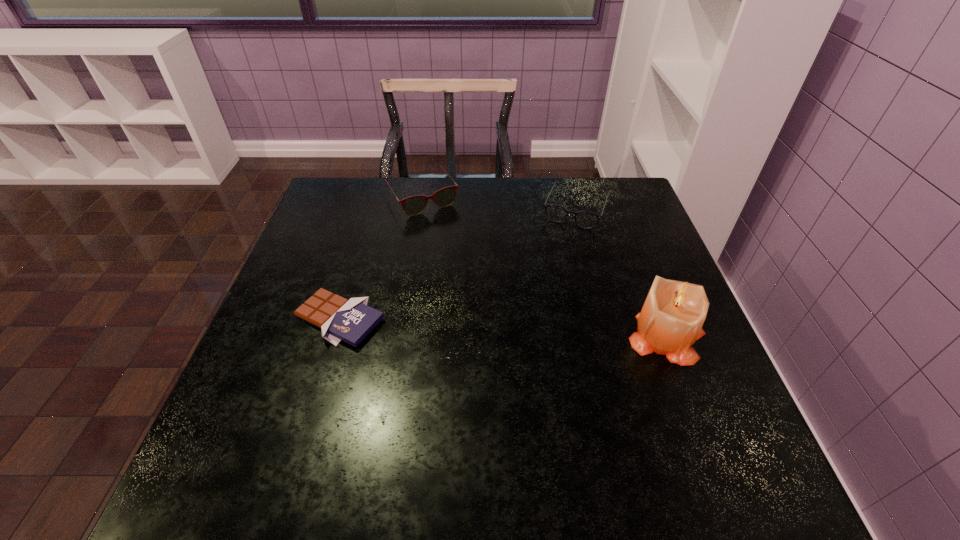
The height and width of the screenshot is (540, 960). In the image, there is a desktop. In order to click on vacant space at the far left corner in this screenshot , I will do `click(371, 190)`.

In the image, there is a desktop. Identify the location of free space at the far right corner. The image size is (960, 540). click(x=622, y=217).

I want to click on vacant space that's between the candle and the left spectacles, so click(544, 268).

Find the location of a particular element. The height and width of the screenshot is (540, 960). free area in between the tallest object and the right spectacles is located at coordinates (622, 273).

You are a GUI agent. You are given a task and a screenshot of the screen. Output one action in this format:
    pyautogui.click(x=<x>, y=<y>)
    Task: Click on the vacant space that's between the tallest object and the shortest object
    This screenshot has width=960, height=540.
    Given the screenshot: What is the action you would take?
    pyautogui.click(x=503, y=328)

At what (x,y) coordinates should I click in order to perform the action: click on free space between the candle and the left spectacles. Please return your answer as a coordinate pair (x, y). The height and width of the screenshot is (540, 960). Looking at the image, I should click on (544, 268).

You are a GUI agent. You are given a task and a screenshot of the screen. Output one action in this format:
    pyautogui.click(x=<x>, y=<y>)
    Task: Click on the free space between the chocolate bar and the tallest object
    This screenshot has height=540, width=960.
    Given the screenshot: What is the action you would take?
    pyautogui.click(x=503, y=328)

Identify the location of vacant space that is in between the left spectacles and the tallest object. (544, 268).

The height and width of the screenshot is (540, 960). Find the location of `free space between the candle and the left spectacles`. free space between the candle and the left spectacles is located at coordinates coord(544,268).

You are a GUI agent. You are given a task and a screenshot of the screen. Output one action in this format:
    pyautogui.click(x=<x>, y=<y>)
    Task: Click on the free space between the tallest object and the left spectacles
    This screenshot has height=540, width=960.
    Given the screenshot: What is the action you would take?
    pyautogui.click(x=544, y=268)